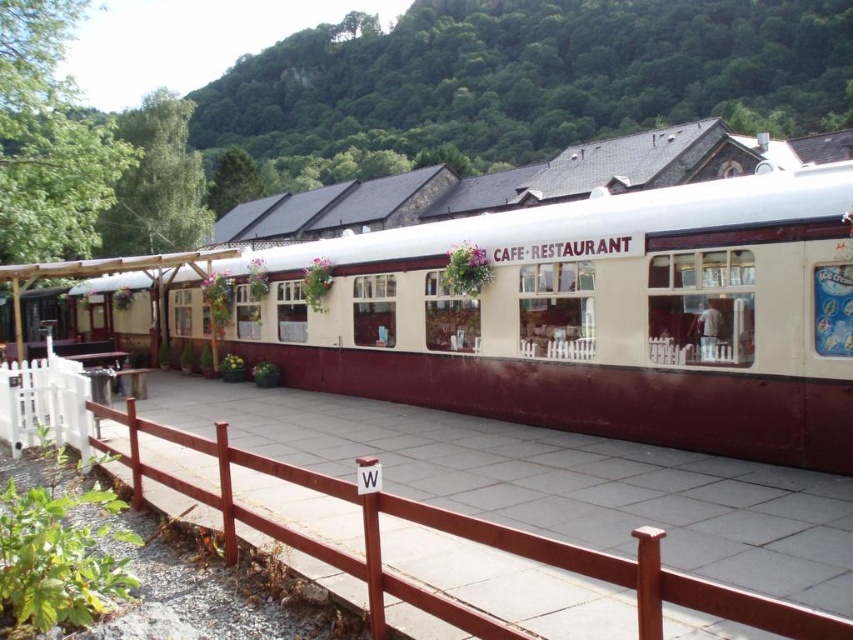
Between white matte train car at center and brown wooden fence at center, which one has more height?

white matte train car at center

Which is more to the right, white matte train car at center or brown wooden fence at center?

brown wooden fence at center

Image resolution: width=853 pixels, height=640 pixels. What do you see at coordinates (592, 316) in the screenshot?
I see `white matte train car at center` at bounding box center [592, 316].

You are a GUI agent. You are given a task and a screenshot of the screen. Output one action in this format:
    pyautogui.click(x=<x>, y=<y>)
    Task: Click on the white matte train car at center
    The height and width of the screenshot is (640, 853).
    Given the screenshot: What is the action you would take?
    pyautogui.click(x=592, y=316)